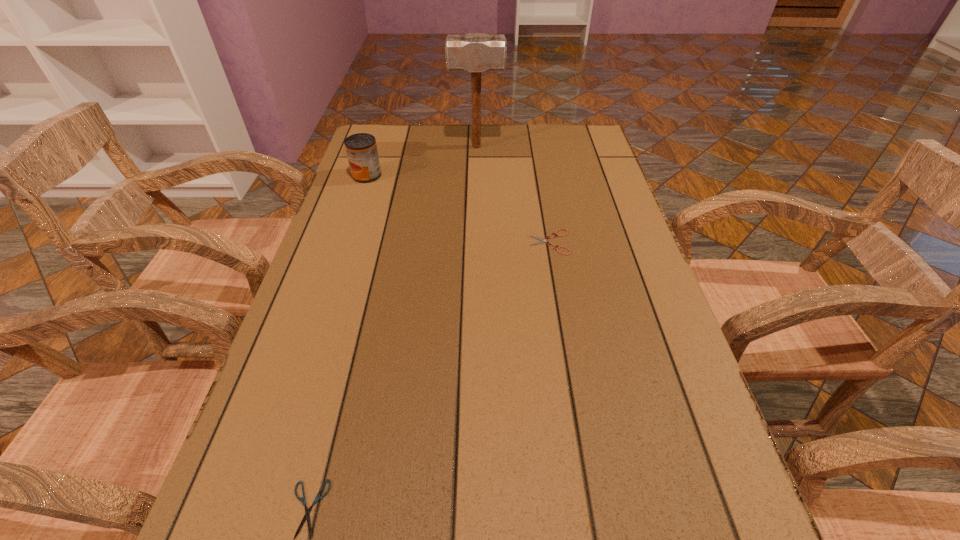
This screenshot has width=960, height=540. I want to click on object present at the left edge, so click(361, 148).

Where is `object at the right edge`? The width and height of the screenshot is (960, 540). object at the right edge is located at coordinates (543, 240).

The image size is (960, 540). In the image, there is a desktop. Identify the location of vacant space at the far edge. (540, 127).

What are the coordinates of `free region at the left edge of the desktop` in the screenshot? It's located at click(x=391, y=241).

Identify the location of free location at the right edge. The height and width of the screenshot is (540, 960). (623, 219).

This screenshot has width=960, height=540. Identify the location of vacant space at the far left corner of the desktop. (382, 146).

Identify the location of free location at the far right corner of the desktop. (593, 140).

Identify the location of free space between the third shortest object and the tallest object. The width and height of the screenshot is (960, 540). (421, 161).

This screenshot has width=960, height=540. Identify the location of empty space between the second nearest object and the tallest object. (513, 194).

At what (x,y) coordinates should I click in order to perform the action: click on vacant region between the tallest object and the taller shears. Please return your answer as a coordinate pair (x, y). This screenshot has width=960, height=540. Looking at the image, I should click on (513, 194).